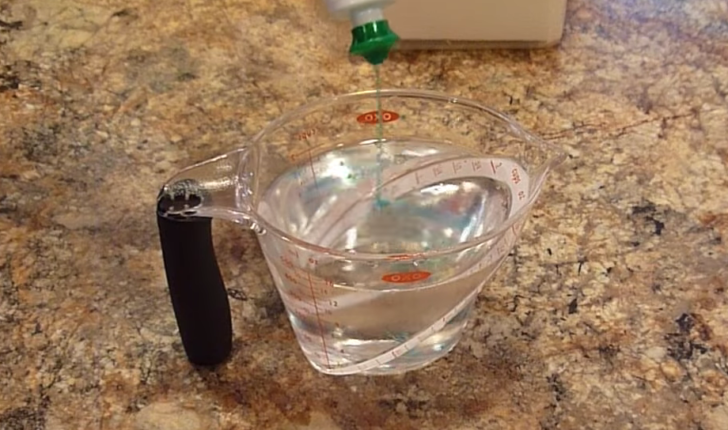
Image resolution: width=728 pixels, height=430 pixels. What are the coordinates of `empty space on table` in the screenshot? It's located at (130, 90).